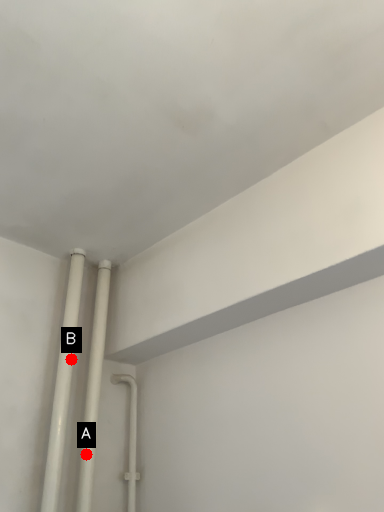
Question: Two points are circled on the image, labeled by A and B beside each circle. Which point is closer to the camera?

Choices:
 (A) A is closer
 (B) B is closer

Answer: (A)